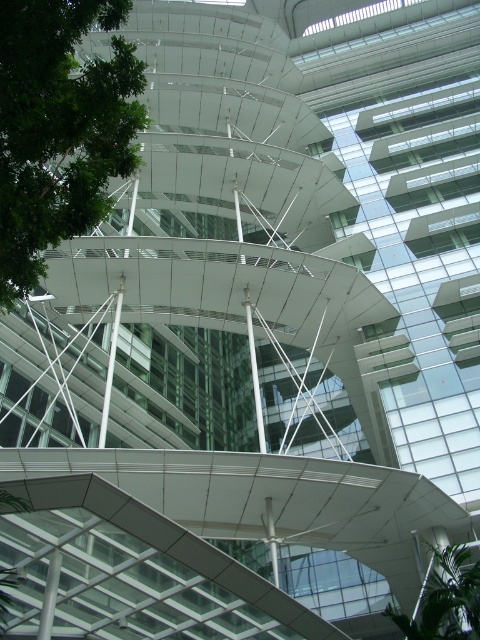
You are a drone operator tasked with photographing the green leafy tree at upper left. The drone has a maximum flight range of 25 meters. Can the drone safely reach the tree without exceeding its range limit?

The green leafy tree at upper left is 24.69 meters from camera, so the drone can safely reach it without exceeding its 25 meter range limit.

In the scene shown: You are standing in front of the modern architectural structure shown in the image. You notice a point marked at coordinates (60, 129). Based on the scene description, can you identify what object this point is located on?

The point at coordinates (60, 129) is located on the green leafy tree at upper left.